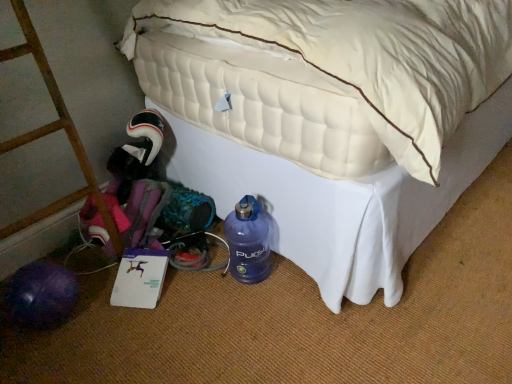
Question: Is brushed metal ladder at left bigger than white quilted mattress at lower left?

Choices:
 (A) yes
 (B) no

Answer: (B)

Question: From a real-world perspective, is brushed metal ladder at left positioned under white quilted mattress at lower left based on gravity?

Choices:
 (A) no
 (B) yes

Answer: (A)

Question: Does brushed metal ladder at left contain white quilted mattress at lower left?

Choices:
 (A) no
 (B) yes

Answer: (A)

Question: Is the position of brushed metal ladder at left less distant than that of white quilted mattress at lower left?

Choices:
 (A) no
 (B) yes

Answer: (A)

Question: Can you confirm if brushed metal ladder at left is shorter than white quilted mattress at lower left?

Choices:
 (A) no
 (B) yes

Answer: (B)

Question: Considering the positions of blue matte water bottle at lower center and white quilted mattress at lower left in the image, is blue matte water bottle at lower center wider or thinner than white quilted mattress at lower left?

Choices:
 (A) thin
 (B) wide

Answer: (A)

Question: From the image's perspective, is blue matte water bottle at lower center located above or below white quilted mattress at lower left?

Choices:
 (A) below
 (B) above

Answer: (A)

Question: Is blue matte water bottle at lower center taller or shorter than white quilted mattress at lower left?

Choices:
 (A) short
 (B) tall

Answer: (A)

Question: Which is correct: blue matte water bottle at lower center is inside white quilted mattress at lower left, or outside of it?

Choices:
 (A) outside
 (B) inside

Answer: (B)

Question: Considering the positions of brushed metal ladder at left and blue matte water bottle at lower center in the image, is brushed metal ladder at left wider or thinner than blue matte water bottle at lower center?

Choices:
 (A) wide
 (B) thin

Answer: (A)

Question: Is point (14, 231) closer or farther from the camera than point (266, 235)?

Choices:
 (A) closer
 (B) farther

Answer: (A)

Question: Is brushed metal ladder at left in front of or behind blue matte water bottle at lower center in the image?

Choices:
 (A) behind
 (B) front

Answer: (B)

Question: Considering the positions of brushed metal ladder at left and blue matte water bottle at lower center in the image, is brushed metal ladder at left taller or shorter than blue matte water bottle at lower center?

Choices:
 (A) short
 (B) tall

Answer: (B)

Question: Visually, is white quilted mattress at lower left positioned to the left or to the right of blue matte water bottle at lower center?

Choices:
 (A) left
 (B) right

Answer: (B)

Question: From their relative heights in the image, would you say white quilted mattress at lower left is taller or shorter than blue matte water bottle at lower center?

Choices:
 (A) short
 (B) tall

Answer: (B)